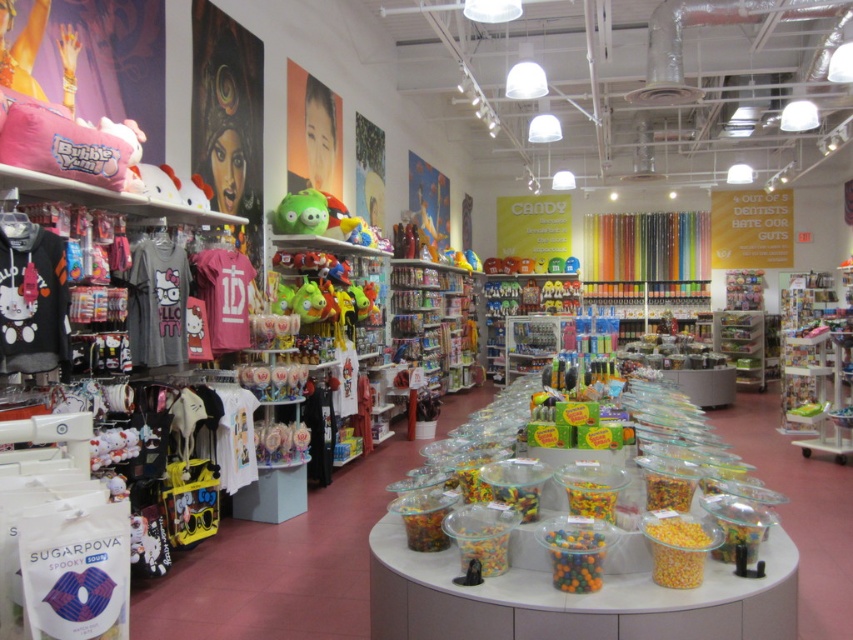
Measure the distance from translucent plastic corn at center to translucent plastic container at center.

The distance of translucent plastic corn at center from translucent plastic container at center is 27.93 centimeters.

From the picture: Can you confirm if translucent plastic corn at center is smaller than translucent plastic container at center?

No, translucent plastic corn at center is not smaller than translucent plastic container at center.

Is point (676, 573) closer to viewer compared to point (579, 545)?

No, it is not.

Locate an element on the screen. This screenshot has height=640, width=853. translucent plastic corn at center is located at coordinates (677, 548).

Is point (709, 536) positioned before point (316, 204)?

Yes, point (709, 536) is closer to viewer.

Is translucent plastic corn at center to the right of green rubber toy at center from the viewer's perspective?

Correct, you'll find translucent plastic corn at center to the right of green rubber toy at center.

Where is `translucent plastic corn at center`? Image resolution: width=853 pixels, height=640 pixels. translucent plastic corn at center is located at coordinates (677, 548).

Locate an element on the screen. translucent plastic corn at center is located at coordinates (677, 548).

Between translucent plastic container at center and green rubber toy at center, which one appears on the left side from the viewer's perspective?

green rubber toy at center

Which is in front, point (564, 534) or point (271, 221)?

Point (564, 534) is more forward.

I want to click on translucent plastic container at center, so click(x=576, y=554).